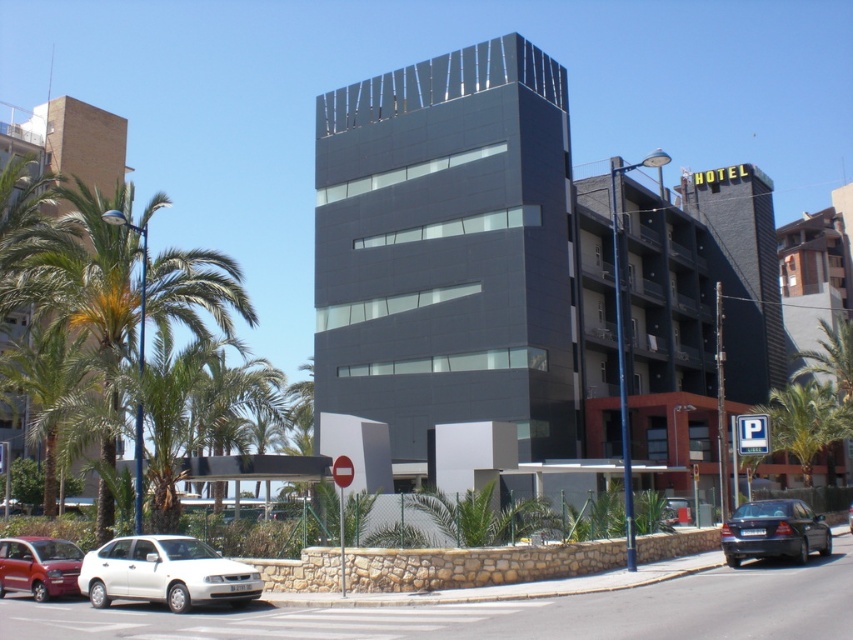
Question: Can you confirm if matte glass building at left is positioned to the left of green leafy palm tree at lower right?

Choices:
 (A) no
 (B) yes

Answer: (B)

Question: Which object is positioned farthest from the shiny black sedan at lower right?

Choices:
 (A) metallic red car at lower left
 (B) matte glass building at left

Answer: (B)

Question: Can you confirm if green leafy palm tree at lower right is wider than silver metallic sedan at center?

Choices:
 (A) yes
 (B) no

Answer: (A)

Question: Can you confirm if white matte sedan at lower left is smaller than green leafy palm tree at lower right?

Choices:
 (A) yes
 (B) no

Answer: (A)

Question: Estimate the real-world distances between objects in this image. Which object is farther from the metallic red car at lower left?

Choices:
 (A) silver metallic sedan at center
 (B) green leafy palm tree at left
 (C) white matte sedan at lower left

Answer: (A)

Question: Which point is closer to the camera taking this photo?

Choices:
 (A) (12, 132)
 (B) (33, 540)
 (C) (817, 410)

Answer: (B)